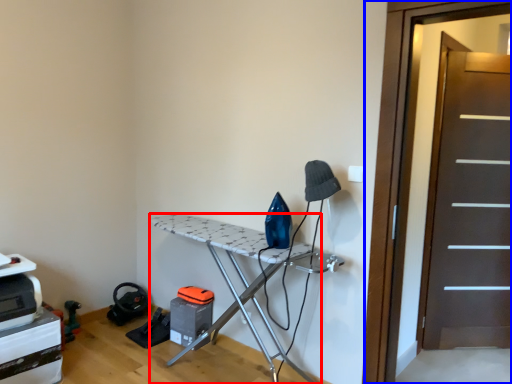
Question: Which object is further to the camera taking this photo, furniture (highlighted by a red box) or screen door (highlighted by a blue box)?

Choices:
 (A) furniture
 (B) screen door

Answer: (A)